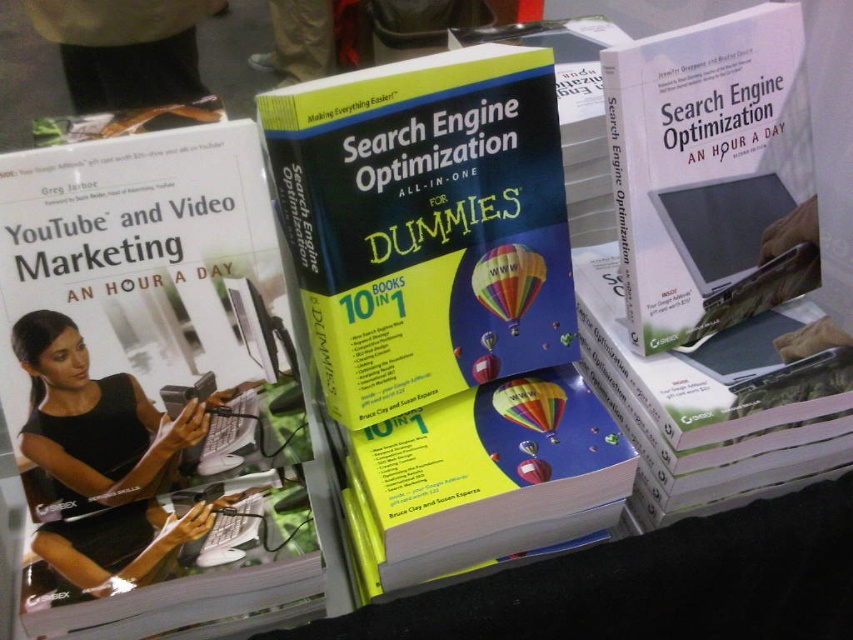
Is black matte laptop at lower left positioned at the back of multicolored fabric balloon at center?

No.

Is black matte laptop at lower left to the left of multicolored fabric balloon at center from the viewer's perspective?

Yes, black matte laptop at lower left is to the left of multicolored fabric balloon at center.

This screenshot has height=640, width=853. What do you see at coordinates (103, 458) in the screenshot?
I see `black matte laptop at lower left` at bounding box center [103, 458].

Where is `black matte laptop at lower left`? This screenshot has height=640, width=853. black matte laptop at lower left is located at coordinates (103, 458).

Does white paper book at center appear on the right side of yellow matte book at center?

Yes, white paper book at center is to the right of yellow matte book at center.

What do you see at coordinates (698, 145) in the screenshot? I see `white paper book at center` at bounding box center [698, 145].

The image size is (853, 640). What are the coordinates of `white paper book at center` in the screenshot? It's located at (698, 145).

Which is below, yellow paperback book at center or black matte laptop at lower left?

Positioned lower is black matte laptop at lower left.

Consider the image. Is yellow paperback book at center to the right of black matte laptop at lower left from the viewer's perspective?

Indeed, yellow paperback book at center is positioned on the right side of black matte laptop at lower left.

Who is more distant from viewer, (477, 385) or (57, 374)?

Positioned behind is point (477, 385).

Locate an element on the screen. The width and height of the screenshot is (853, 640). yellow paperback book at center is located at coordinates (425, 225).